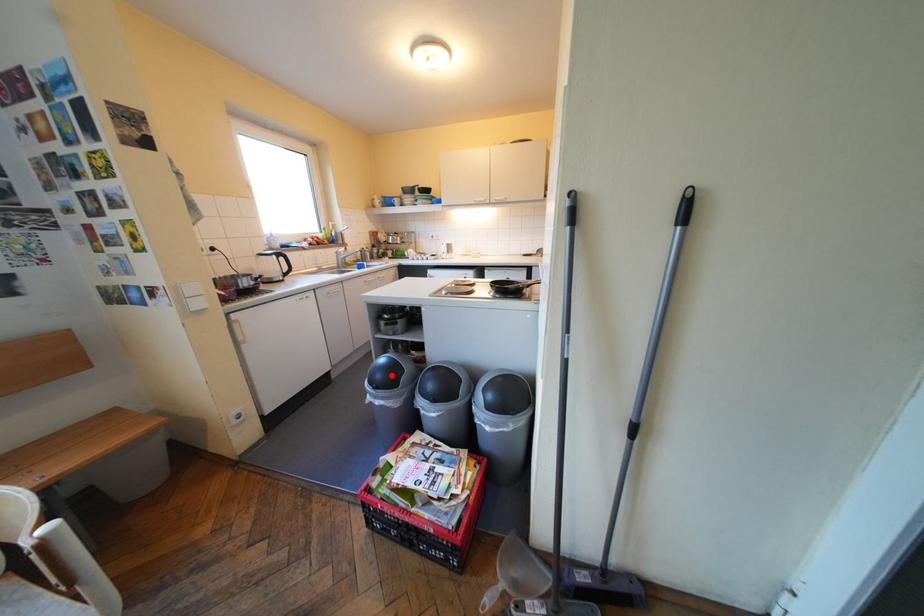
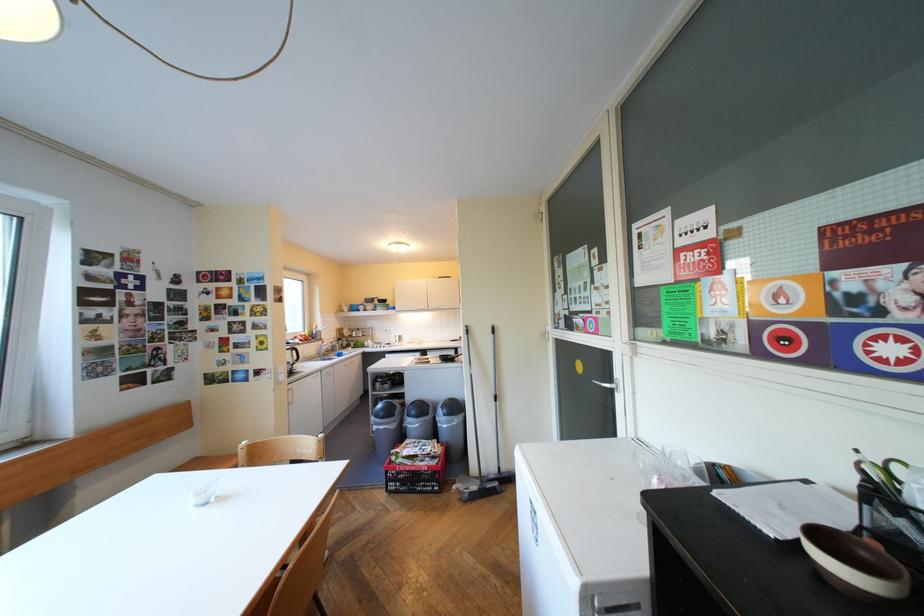
Where in the second image is the point corresponding to the highlighted location from the first image?

(394, 411)